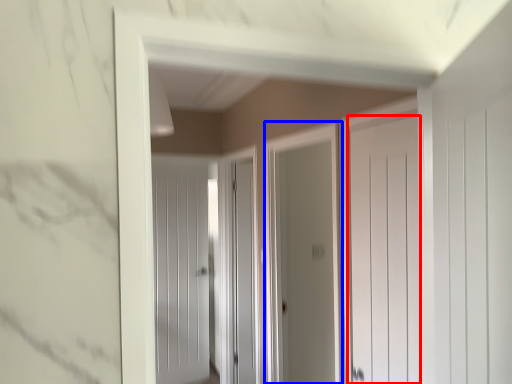
Question: Which of the following is the farthest to the observer, door (highlighted by a red box) or screen door (highlighted by a blue box)?

Choices:
 (A) door
 (B) screen door

Answer: (B)